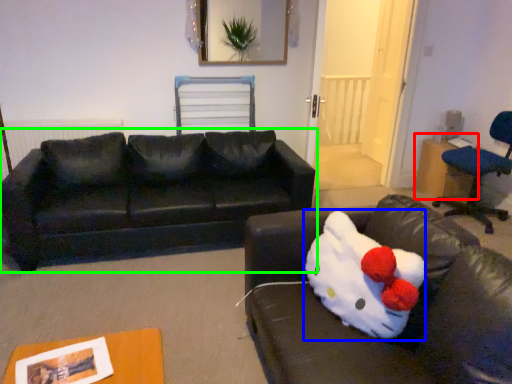
Question: Which is farther away from table (highlighted by a red box)? animal (highlighted by a blue box) or studio couch (highlighted by a green box)?

Choices:
 (A) animal
 (B) studio couch

Answer: (A)